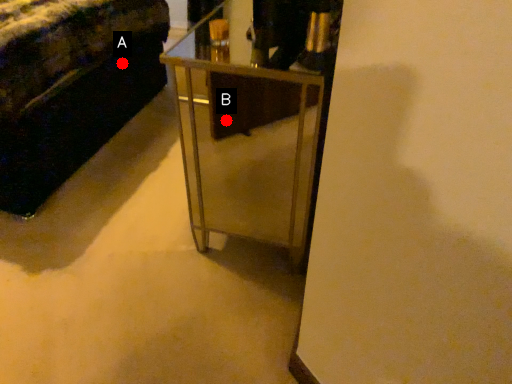
Question: Two points are circled on the image, labeled by A and B beside each circle. Which of the following is the closest to the observer?

Choices:
 (A) A is closer
 (B) B is closer

Answer: (B)